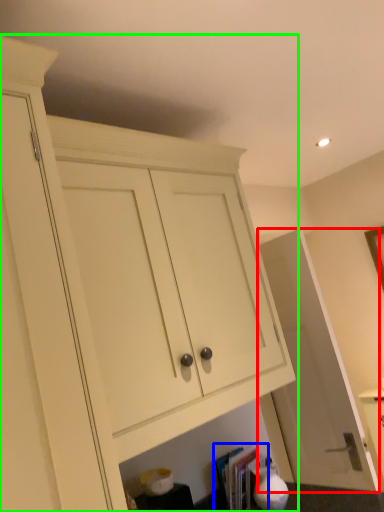
Question: Which object is the farthest from door (highlighted by a red box)? Choose among these: book (highlighted by a blue box) or cabinetry (highlighted by a green box).

Choices:
 (A) book
 (B) cabinetry

Answer: (B)